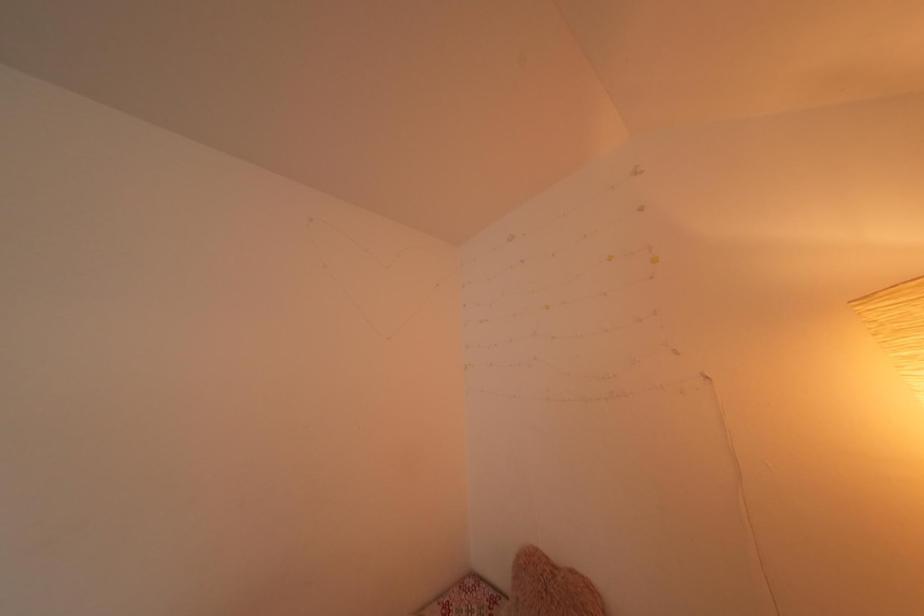
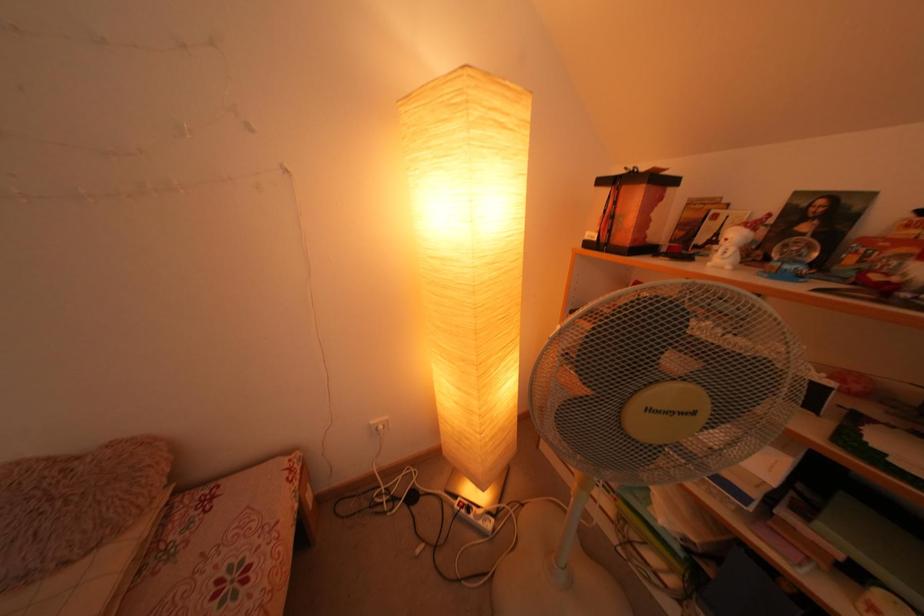
The first image is from the beginning of the video and the second image is from the end. How did the camera likely rotate when shooting the video?

The camera's rotation is toward right-down.